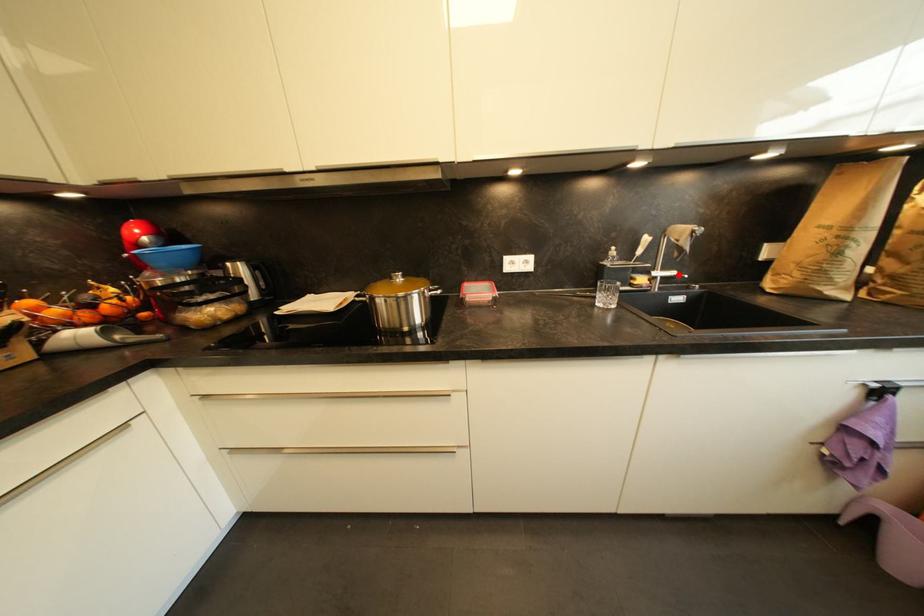
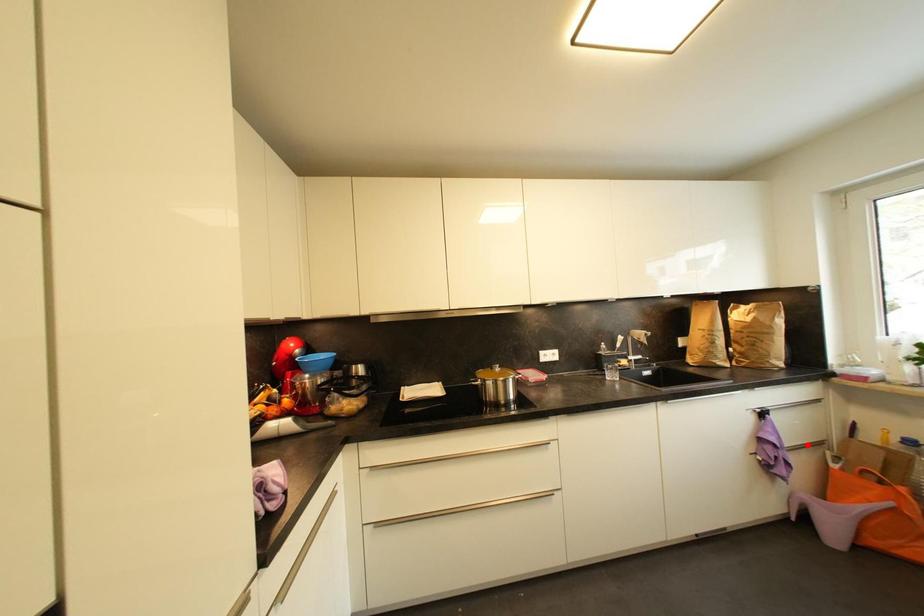
I am providing you with two images of the same scene from different viewpoints. A red point is marked on the first image and another point is marked on the second image. Are the points marked in image1 and image2 representing the same 3D position?

No